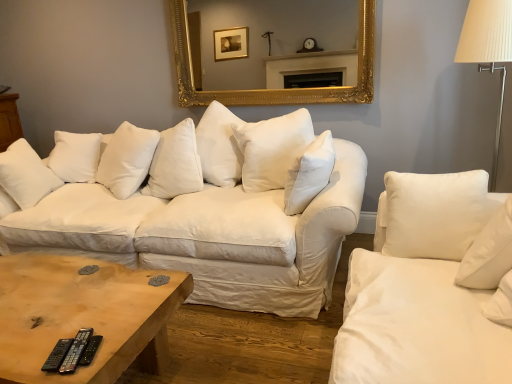
The width and height of the screenshot is (512, 384). I want to click on empty space that is to the right of black plastic remote at lower left, which is counted as the 1th remote, starting from the right, so click(x=118, y=339).